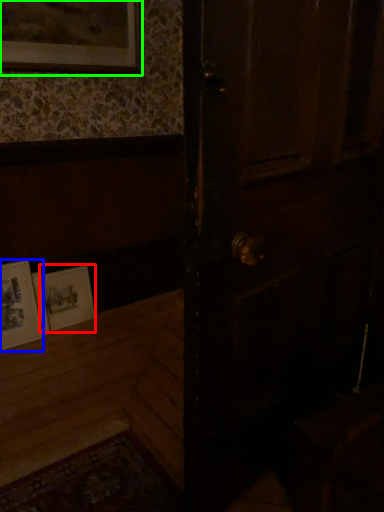
Question: Estimate the real-world distances between objects in this image. Which object is closer to picture frame (highlighted by a red box), picture frame (highlighted by a blue box) or picture frame (highlighted by a green box)?

Choices:
 (A) picture frame
 (B) picture frame

Answer: (A)